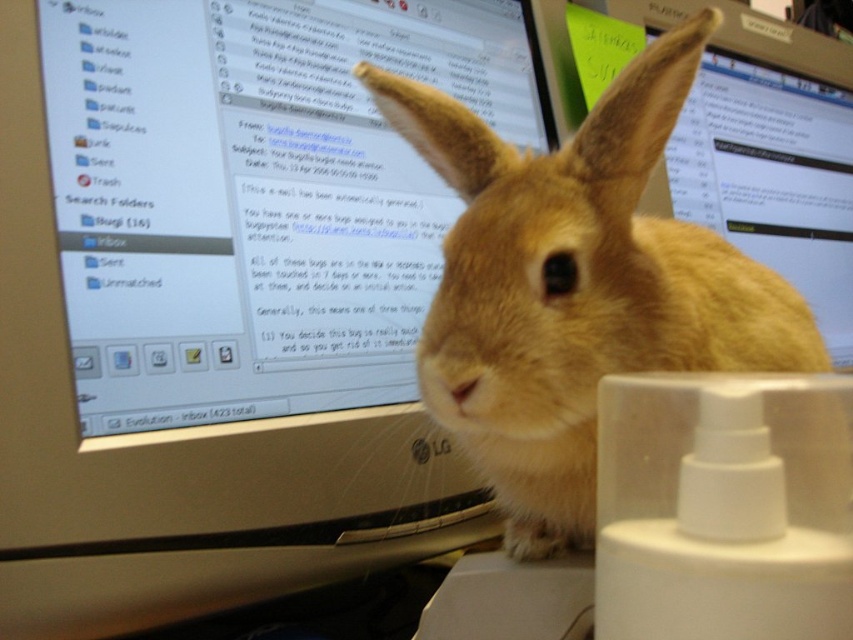
You are setting up a new desk arrangement and want to place a 18 inch wide laptop between the white plastic monitor at upper center and the matte plastic monitor at center. Is there enough space between them to fit the laptop?

The white plastic monitor at upper center is 20.29 inches from the matte plastic monitor at center, so yes, the 18 inch wide laptop can fit between them since the distance between the two monitors is greater than the laptop width.

You are trying to locate two points on the desk where the rabbit is sitting. The first point is at coordinates point (380,70) and the second is at point (844,70). From your perspective standing in front of the desk, which point is closer to you?

Point (380,70) is in front of point (844,70), so it is closer to you.

You are trying to reach the white plastic monitor at upper center to adjust its settings, but there is a furry beige rabbit at center in the way. Can you move the rabbit to access the monitor?

The white plastic monitor at upper center is much taller than the furry beige rabbit at center, so you can likely reach over the rabbit to adjust the monitor without moving it.